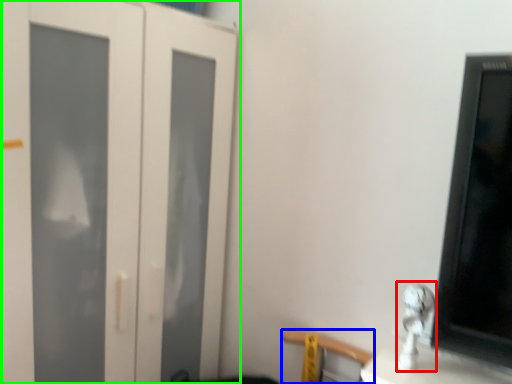
Question: Which is farther away from silver (highlighted by a red box)? chair (highlighted by a blue box) or door (highlighted by a green box)?

Choices:
 (A) chair
 (B) door

Answer: (B)